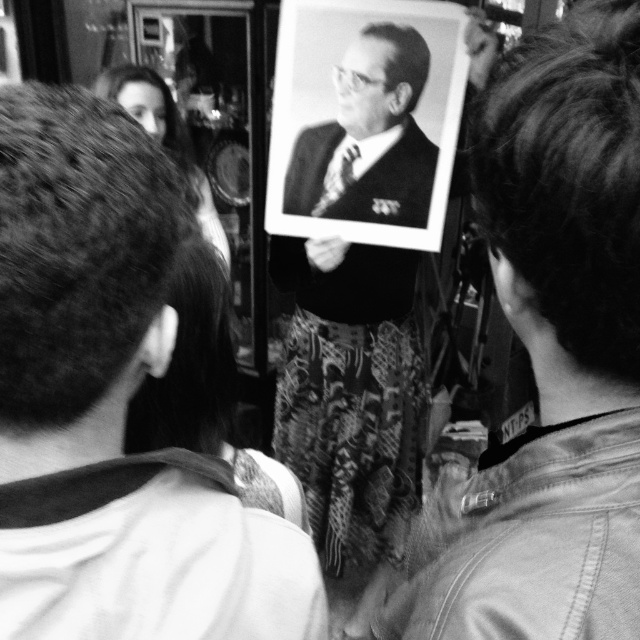
From the picture: You are organizing a fashion show and need to arrange two suits from the image for a display. The black textured suit at center and the smooth black suit at center must be placed side by side. Which one should you place on the higher platform to match their sizes?

The black textured suit at center should be placed on the higher platform because it is taller than the smooth black suit at center.

You are organizing a fashion show and need to place two suits on a mannequin. The smooth suit at center and the black textured suit at center must be arranged so that the smaller one is on top. Which suit should you place on top?

The smooth suit at center is smaller than the black textured suit at center, so you should place the smooth suit at center on top.